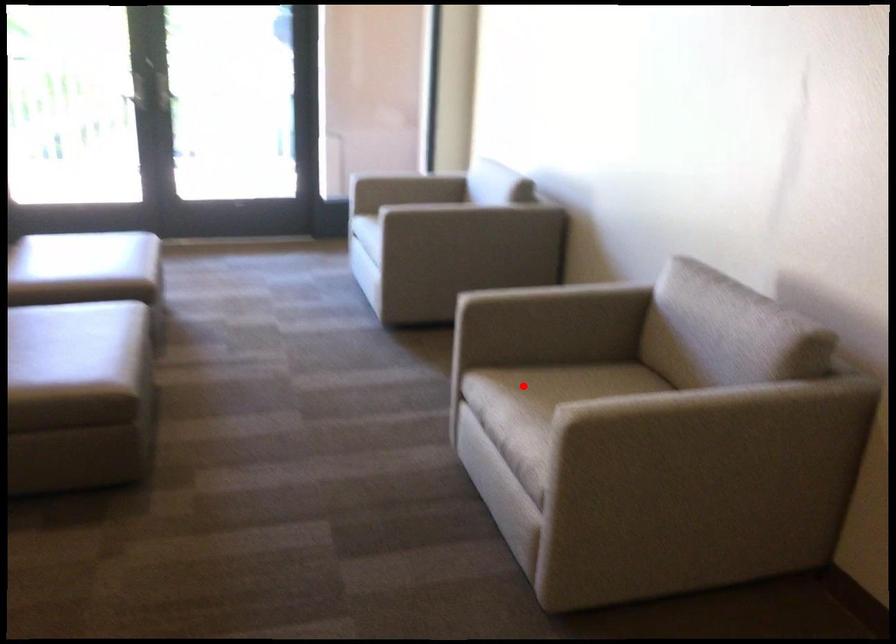
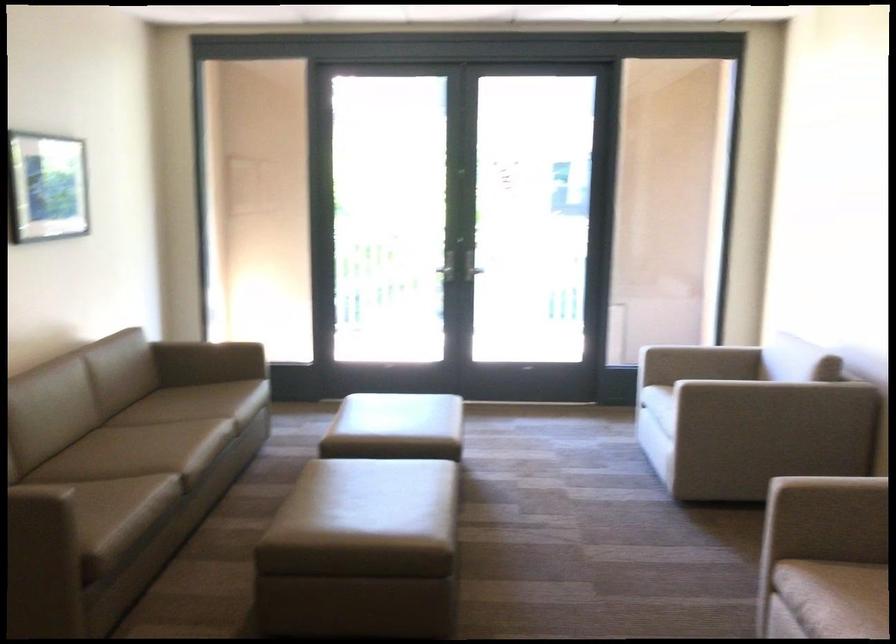
Question: I am providing you with two images of the same scene from different viewpoints. A red point is marked on the first image. At the location where the point appears in image 1, is it still visible in image 2?

Choices:
 (A) Yes
 (B) No

Answer: (A)